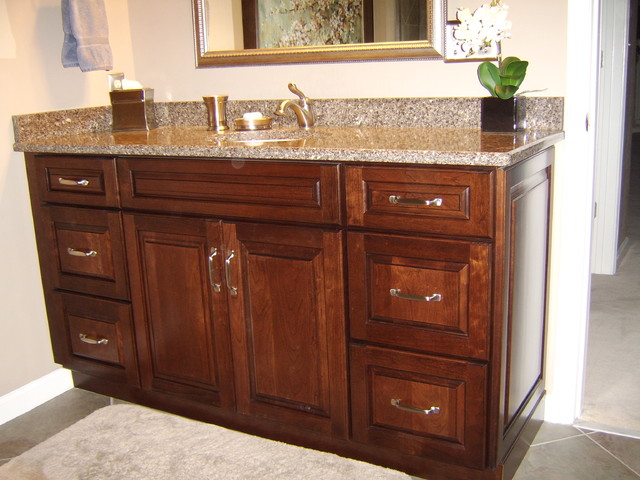
The image size is (640, 480). Find the location of `plant in container`. plant in container is located at coordinates (506, 106).